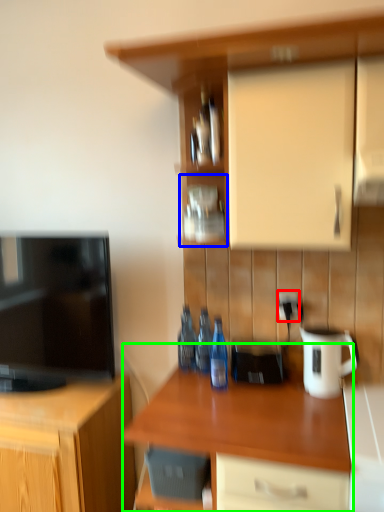
Question: Which object is the closest to the electric outlet (highlighted by a red box)? Choose among these: shelf (highlighted by a blue box) or countertop (highlighted by a green box).

Choices:
 (A) shelf
 (B) countertop

Answer: (A)